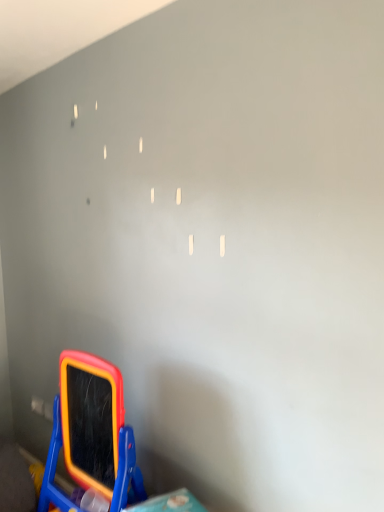
What do you see at coordinates (92, 434) in the screenshot? This screenshot has width=384, height=512. I see `rubberized plastic easel at lower left` at bounding box center [92, 434].

Where is `rubberized plastic easel at lower left`? This screenshot has width=384, height=512. rubberized plastic easel at lower left is located at coordinates (92, 434).

What is the approximate height of rubberized plastic easel at lower left?

It is 34.58 inches.

Identify the location of rubberized plastic easel at lower left. (92, 434).